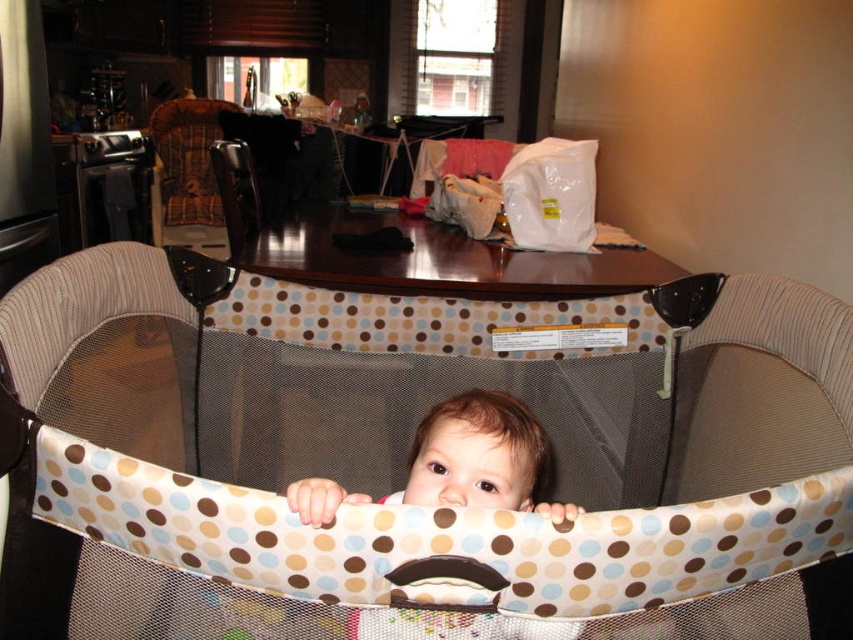
Which of these two, brown fabric baby at center or wooden chair at center, stands taller?

Standing taller between the two is wooden chair at center.

Identify the location of brown fabric baby at center. The height and width of the screenshot is (640, 853). (480, 458).

Who is higher up, brown fabric baby at center or plaid fabric feeding chair at upper left?

plaid fabric feeding chair at upper left

Is brown fabric baby at center behind plaid fabric feeding chair at upper left?

No, it is in front of plaid fabric feeding chair at upper left.

Is point (473, 435) more distant than point (200, 211)?

That is False.

The image size is (853, 640). In order to click on brown fabric baby at center in this screenshot , I will do `click(480, 458)`.

Is brown dotted fabric playpen at center positioned at the back of plaid fabric feeding chair at upper left?

No, it is in front of plaid fabric feeding chair at upper left.

Which is above, brown dotted fabric playpen at center or plaid fabric feeding chair at upper left?

plaid fabric feeding chair at upper left

This screenshot has width=853, height=640. What do you see at coordinates (405, 465) in the screenshot? I see `brown dotted fabric playpen at center` at bounding box center [405, 465].

Locate an element on the screen. The width and height of the screenshot is (853, 640). brown dotted fabric playpen at center is located at coordinates (405, 465).